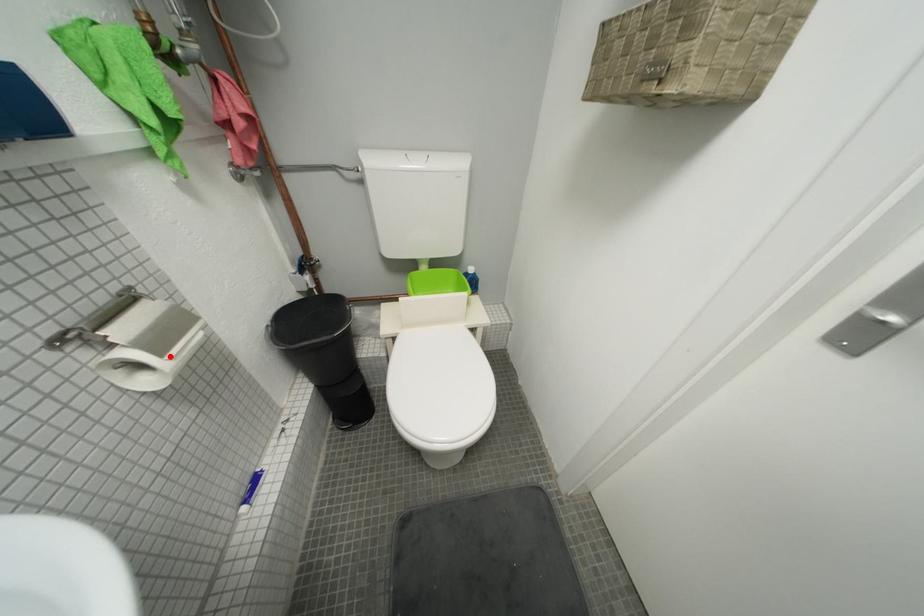
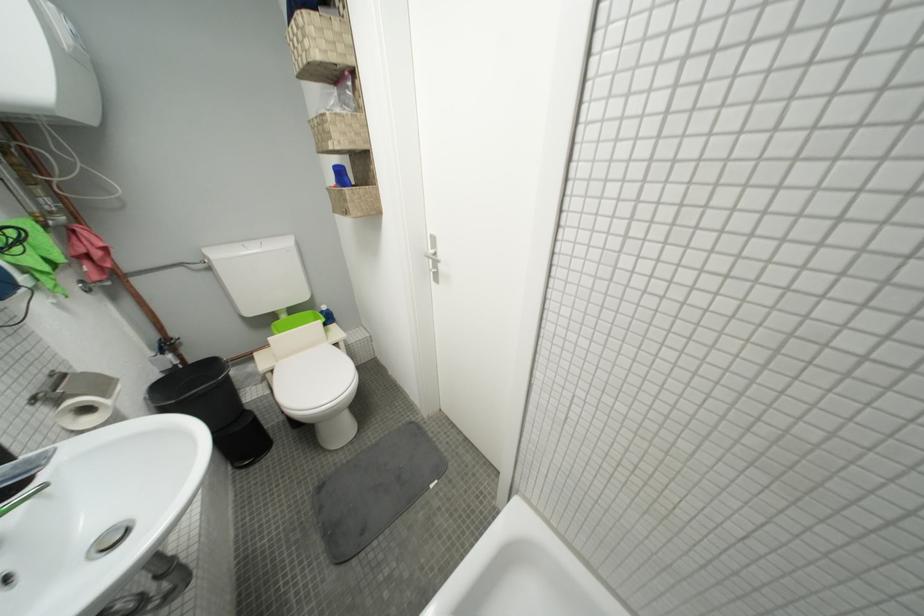
In the second image, find the point that corresponds to the highlighted location in the first image.

(113, 397)